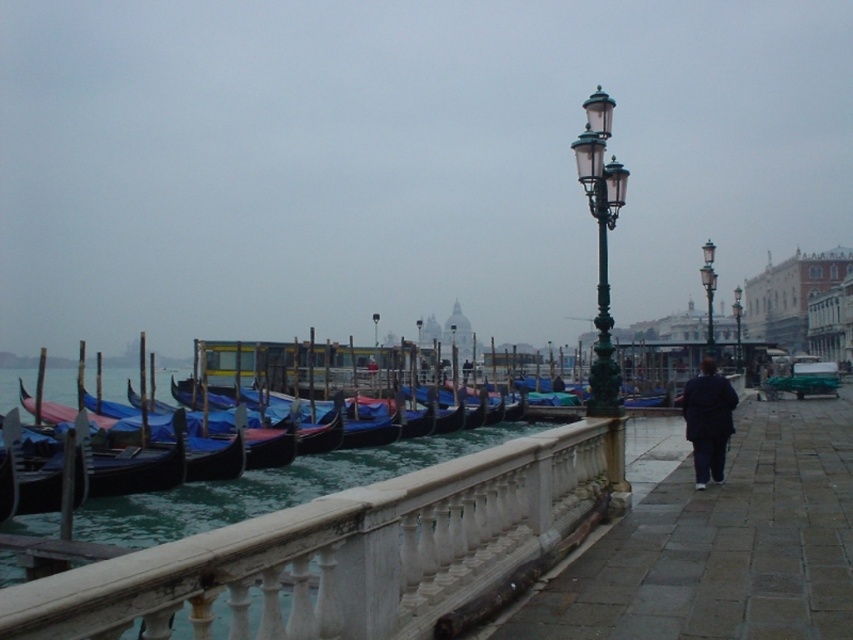
Is dark gray stone pavement at center-right to the left of green metal/glass streetlamp at center-right from the viewer's perspective?

No, dark gray stone pavement at center-right is not to the left of green metal/glass streetlamp at center-right.

Which is in front, point (741, 460) or point (610, 476)?

Point (610, 476) is in front.

At what (x,y) coordinates should I click in order to perform the action: click on dark gray stone pavement at center-right. Please return your answer as a coordinate pair (x, y). Looking at the image, I should click on (723, 545).

At what (x,y) coordinates should I click in order to perform the action: click on dark gray stone pavement at center-right. Please return your answer as a coordinate pair (x, y). This screenshot has height=640, width=853. Looking at the image, I should click on (723, 545).

What do you see at coordinates (601, 243) in the screenshot?
I see `green metal/glass streetlamp at center-right` at bounding box center [601, 243].

Where is `green metal/glass streetlamp at center-right`? green metal/glass streetlamp at center-right is located at coordinates (601, 243).

Does point (616, 172) come behind point (416, 323)?

That is False.

The height and width of the screenshot is (640, 853). I want to click on green metal/glass streetlamp at center-right, so click(x=601, y=243).

Who is lower down, green metal streetlight at center or green glass streetlight at center?

green glass streetlight at center is lower down.

Is point (701, 268) farther from viewer compared to point (375, 333)?

No, it is not.

Measure the distance between point (701, 273) and camera.

Point (701, 273) is 25.20 meters away from camera.

At what (x,y) coordinates should I click in order to perform the action: click on green metal streetlight at center. Please return your answer as a coordinate pair (x, y). Looking at the image, I should click on (708, 291).